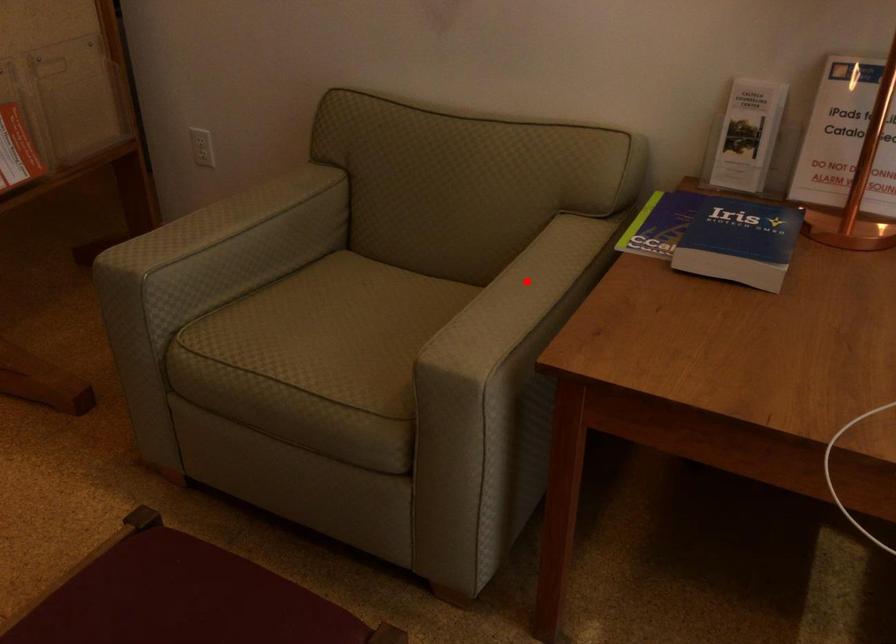
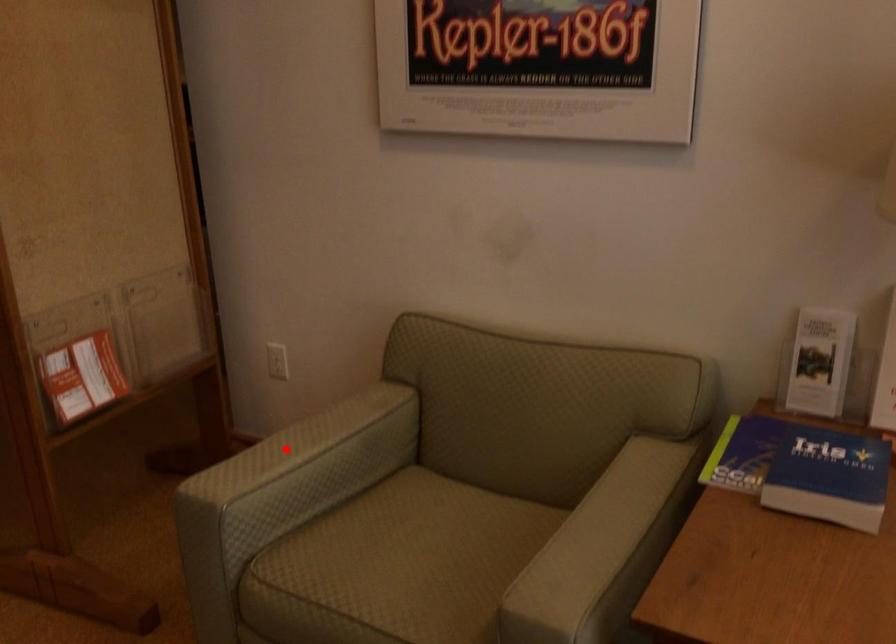
I am providing you with two images of the same scene from different viewpoints. A red point is marked on the first image and another point is marked on the second image. Is the marked point in image1 the same physical position as the marked point in image2?

No